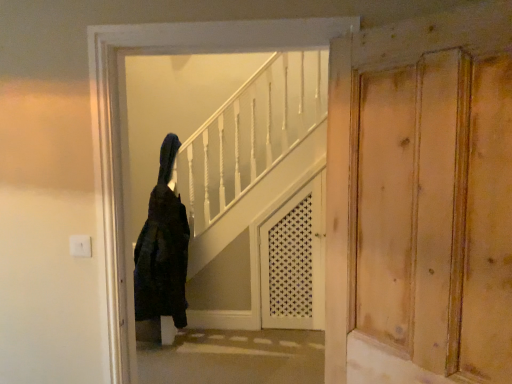
Question: Is white lattice screen door at center wider or thinner than black fuzzy coat at center?

Choices:
 (A) wide
 (B) thin

Answer: (B)

Question: Would you say white lattice screen door at center is to the left or to the right of black fuzzy coat at center in the picture?

Choices:
 (A) left
 (B) right

Answer: (B)

Question: Estimate the real-world distances between objects in this image. Which object is closer to the white lattice screen door at center?

Choices:
 (A) black fuzzy coat at center
 (B) natural wood door at right

Answer: (A)

Question: Which is nearer to the black fuzzy coat at center?

Choices:
 (A) natural wood door at right
 (B) white lattice screen door at center

Answer: (B)